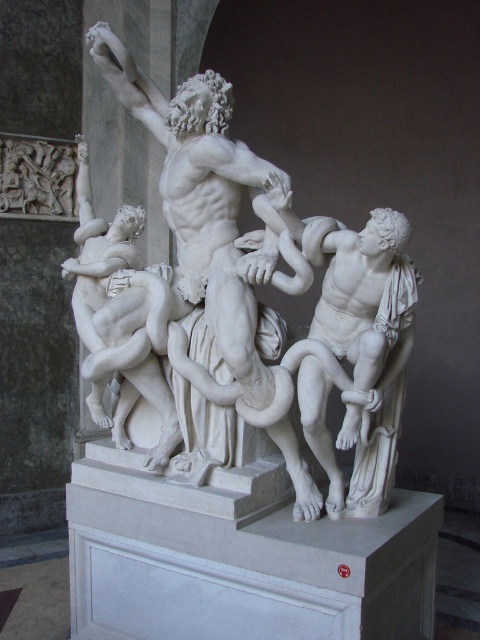
Question: Which object appears farthest from the camera in this image?

Choices:
 (A) white marble sculpture at center
 (B) white marble figure at right

Answer: (A)

Question: Is white marble sculpture at center to the left of white marble figure at right from the viewer's perspective?

Choices:
 (A) yes
 (B) no

Answer: (A)

Question: Which object appears farthest from the camera in this image?

Choices:
 (A) white marble sculpture at center
 (B) white marble figure at right

Answer: (A)

Question: Is white marble sculpture at center thinner than white marble figure at right?

Choices:
 (A) yes
 (B) no

Answer: (B)

Question: Is white marble sculpture at center closer to the viewer compared to white marble figure at right?

Choices:
 (A) no
 (B) yes

Answer: (A)